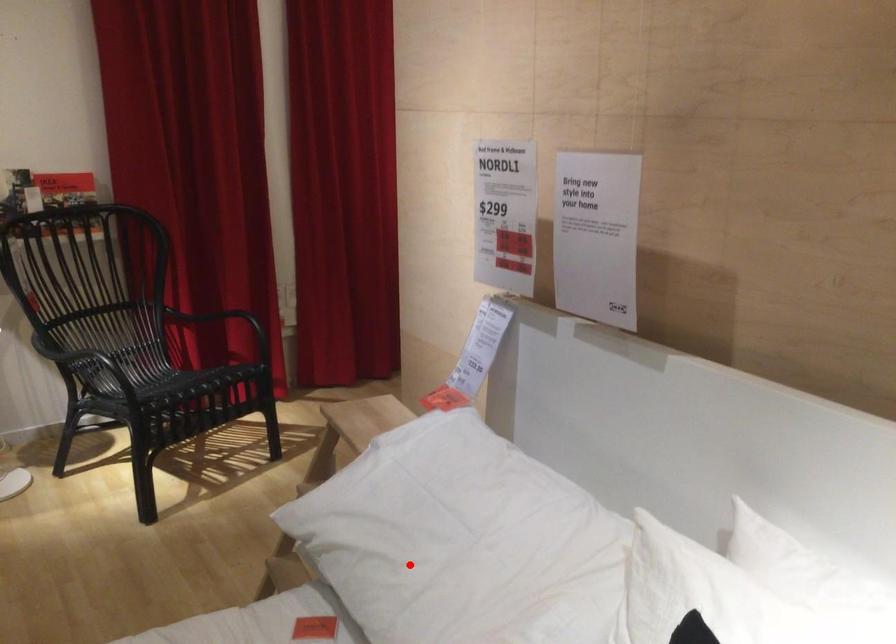
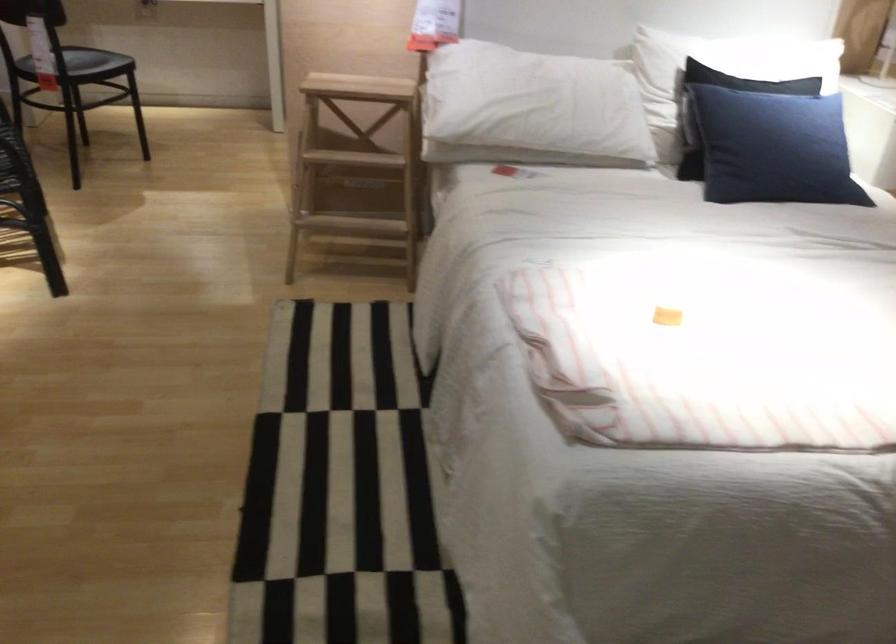
Question: A red point is marked in image1. In image2, is the corresponding 3D point closer to the camera or farther? Reply with the corresponding letter.

Choices:
 (A) The corresponding 3D point is closer.
 (B) The corresponding 3D point is farther.

Answer: (B)